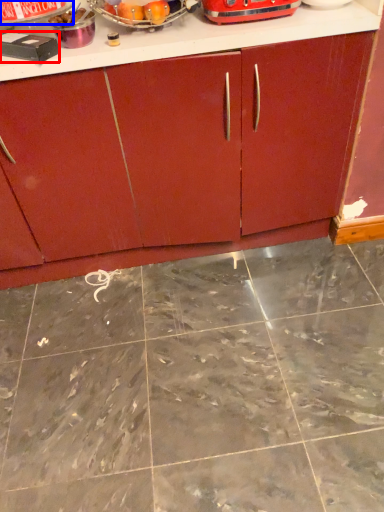
Question: Which object is further to the camera taking this photo, appliance (highlighted by a red box) or appliance (highlighted by a blue box)?

Choices:
 (A) appliance
 (B) appliance

Answer: (B)